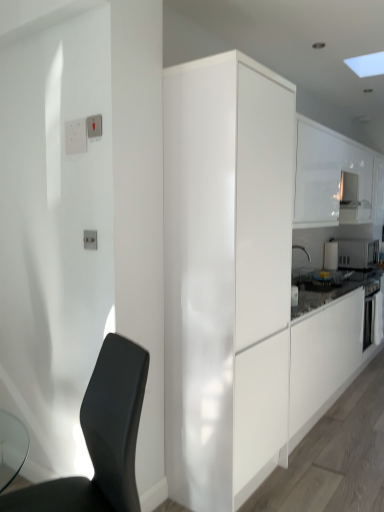
Question: Would you say white glossy cabinet at upper right, placed as the second cabinetry when sorted from front to back, is a long distance from glossy white cabinet at center, placed as the first cabinetry when sorted from left to right?

Choices:
 (A) no
 (B) yes

Answer: (B)

Question: Is glossy white cabinet at center, which ranks as the 1th cabinetry in front-to-back order, surrounded by white glossy cabinet at upper right, which ranks as the 1th cabinetry in right-to-left order?

Choices:
 (A) no
 (B) yes

Answer: (A)

Question: Considering the relative positions of white glossy cabinet at upper right, placed as the second cabinetry when sorted from front to back, and glossy white cabinet at center, which ranks as the 1th cabinetry in front-to-back order, in the image provided, is white glossy cabinet at upper right, placed as the second cabinetry when sorted from front to back, behind glossy white cabinet at center, which ranks as the 1th cabinetry in front-to-back order,?

Choices:
 (A) yes
 (B) no

Answer: (A)

Question: From the image's perspective, is white glossy cabinet at upper right, which is the first cabinetry from back to front, over glossy white cabinet at center, which ranks as the 1th cabinetry in front-to-back order?

Choices:
 (A) yes
 (B) no

Answer: (A)

Question: Is white glossy cabinet at upper right, which is the first cabinetry from back to front, at the left side of glossy white cabinet at center, which ranks as the 2th cabinetry in back-to-front order?

Choices:
 (A) no
 (B) yes

Answer: (A)

Question: From the image's perspective, is white glossy microwave at upper right, arranged as the second appliance when viewed from the right, located above or below white plastic light switch at upper left, which appears as the first light switch when viewed from the front?

Choices:
 (A) below
 (B) above

Answer: (A)

Question: From a real-world perspective, is white glossy microwave at upper right, acting as the first appliance starting from the left, physically located above or below white plastic light switch at upper left, the 2th light switch from the left?

Choices:
 (A) above
 (B) below

Answer: (B)

Question: Based on their sizes in the image, would you say white glossy microwave at upper right, acting as the first appliance starting from the left, is bigger or smaller than white plastic light switch at upper left, the 2th light switch from the left?

Choices:
 (A) big
 (B) small

Answer: (A)

Question: From their relative heights in the image, would you say white glossy microwave at upper right, arranged as the second appliance when viewed from the right, is taller or shorter than white plastic light switch at upper left, which appears as the first light switch when viewed from the front?

Choices:
 (A) tall
 (B) short

Answer: (A)

Question: From their relative heights in the image, would you say matte black chair at lower left is taller or shorter than white glossy microwave at upper right, acting as the first appliance starting from the left?

Choices:
 (A) tall
 (B) short

Answer: (A)

Question: Do you think matte black chair at lower left is within white glossy microwave at upper right, arranged as the second appliance when viewed from the right, or outside of it?

Choices:
 (A) outside
 (B) inside

Answer: (A)

Question: Does point (100, 419) appear closer or farther from the camera than point (326, 264)?

Choices:
 (A) closer
 (B) farther

Answer: (A)

Question: In the image, is matte black chair at lower left positioned in front of or behind white glossy microwave at upper right, arranged as the second appliance when viewed from the right?

Choices:
 (A) behind
 (B) front

Answer: (B)

Question: Considering the relative positions of white plastic light switch at upper left, the 2th light switch from the left, and glossy white cabinet at center, which ranks as the 1th cabinetry in front-to-back order, in the image provided, is white plastic light switch at upper left, the 2th light switch from the left, to the left or to the right of glossy white cabinet at center, which ranks as the 1th cabinetry in front-to-back order,?

Choices:
 (A) right
 (B) left

Answer: (B)

Question: Based on their sizes in the image, would you say white plastic light switch at upper left, which ranks as the second light switch in back-to-front order, is bigger or smaller than glossy white cabinet at center, which ranks as the 1th cabinetry in front-to-back order?

Choices:
 (A) big
 (B) small

Answer: (B)